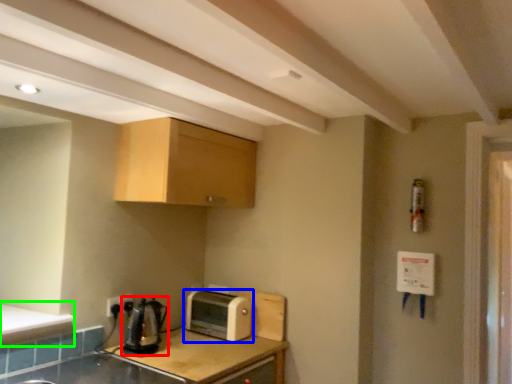
Question: Based on their relative distances, which object is nearer to tea pot (highlighted by a red box)? Choose from toaster (highlighted by a blue box) and counter top (highlighted by a green box).

Choices:
 (A) toaster
 (B) counter top

Answer: (B)